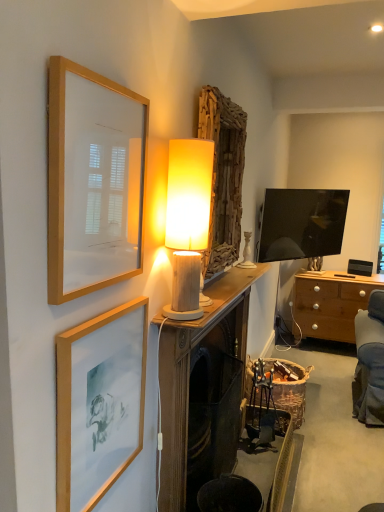
Question: From the image's perspective, is matte gold picture frame at lower left, which is the first picture frame in bottom-to-top order, located above or below wooden chest of drawers at right?

Choices:
 (A) above
 (B) below

Answer: (A)

Question: Looking at their shapes, would you say matte gold picture frame at lower left, which is the first picture frame in bottom-to-top order, is wider or thinner than wooden chest of drawers at right?

Choices:
 (A) thin
 (B) wide

Answer: (A)

Question: Which object is the closest to the wooden framed print at upper left, arranged as the 1th picture frame when viewed from the top?

Choices:
 (A) wooden cylindrical lamp at center
 (B) wooden chest of drawers at right
 (C) metallic silver swivel chair at lower right
 (D) matte gold picture frame at lower left, which is the first picture frame in bottom-to-top order
 (E) wooden mantlepiece at center

Answer: (D)

Question: Based on their relative distances, which object is farther from the wooden mantlepiece at center?

Choices:
 (A) wooden framed print at upper left, arranged as the 1th picture frame when viewed from the top
 (B) wooden chest of drawers at right
 (C) matte gold picture frame at lower left, which is the first picture frame in bottom-to-top order
 (D) metallic silver swivel chair at lower right
 (E) wooden cylindrical lamp at center

Answer: (B)